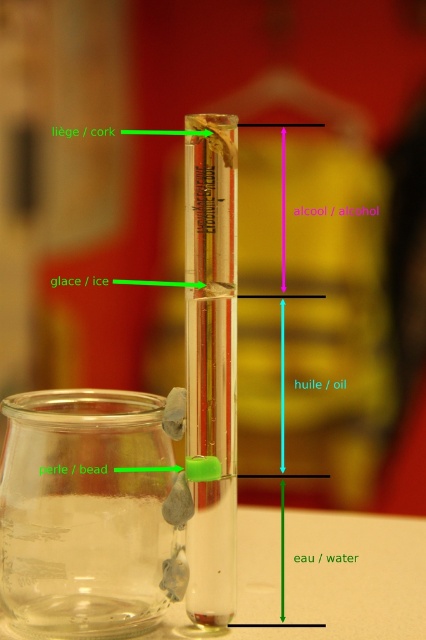
Question: Is transparent glass jar at lower left bigger than transparent glass beaker at center?

Choices:
 (A) no
 (B) yes

Answer: (B)

Question: Which point is closer to the camera?

Choices:
 (A) transparent glass jar at lower left
 (B) transparent glass beaker at center

Answer: (B)

Question: Can you confirm if transparent glass jar at lower left is smaller than transparent glass beaker at center?

Choices:
 (A) yes
 (B) no

Answer: (B)

Question: Among these points, which one is farthest from the camera?

Choices:
 (A) (222, 390)
 (B) (40, 490)

Answer: (B)

Question: Is transparent glass jar at lower left to the right of transparent glass beaker at center from the viewer's perspective?

Choices:
 (A) no
 (B) yes

Answer: (A)

Question: Which object is farther from the camera taking this photo?

Choices:
 (A) transparent glass beaker at center
 (B) transparent glass jar at lower left

Answer: (B)